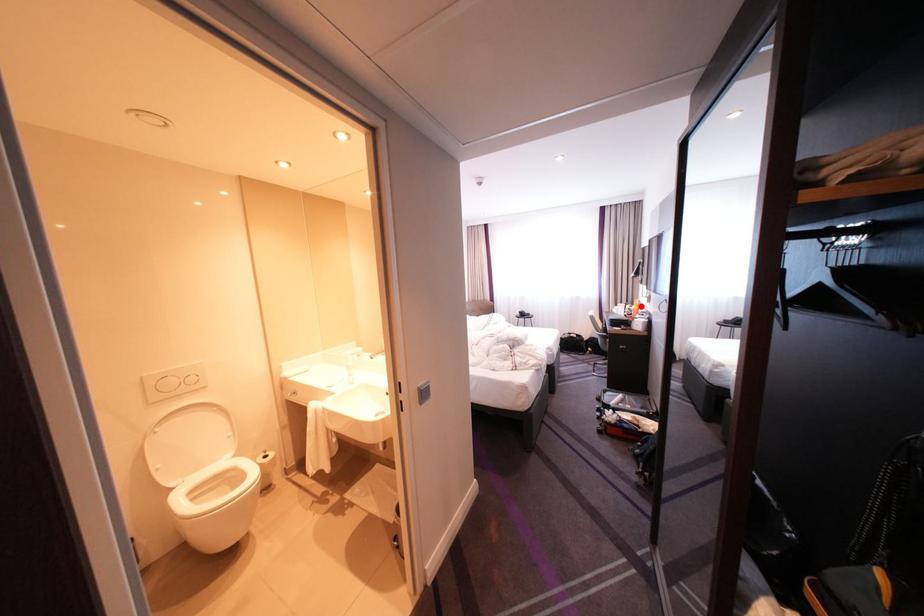
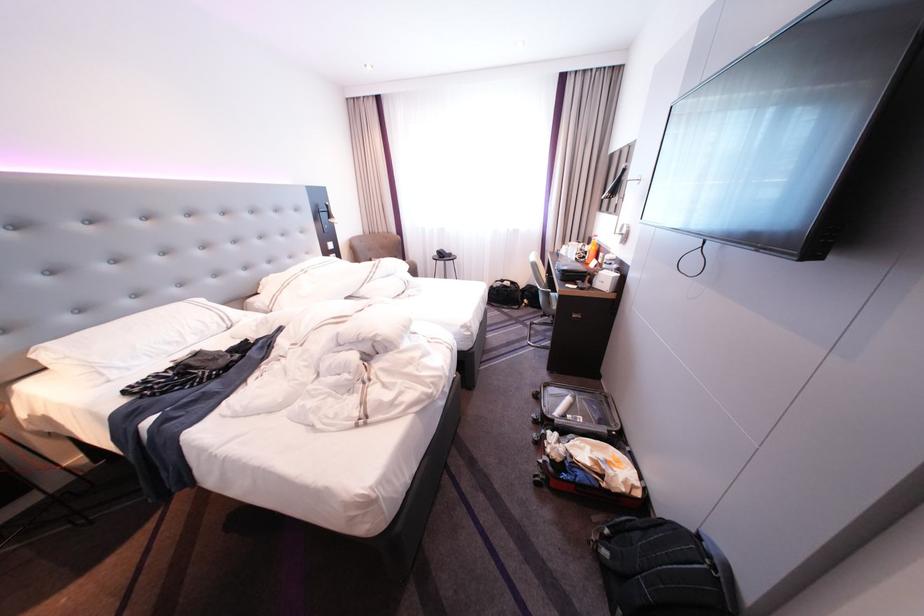
Find the pixel in the second image that matches the highlighted location in the first image.

(593, 245)